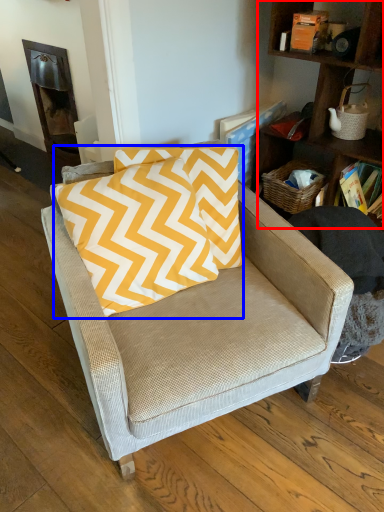
Question: Which object appears farthest to the camera in this image, shelf (highlighted by a red box) or pillow (highlighted by a blue box)?

Choices:
 (A) shelf
 (B) pillow

Answer: (A)